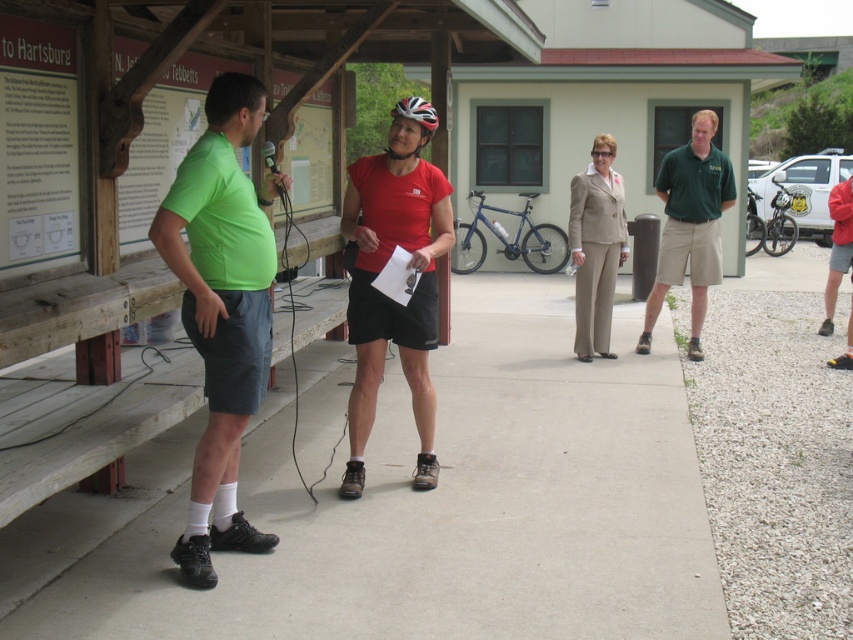
You are attending an outdoor event and want to read the wooden signboard at left and the beige fabric suit at center. Which object is easier to read from your current position?

The wooden signboard at left is closer to the viewer than the beige fabric suit at center, so it is easier to read from your current position.

You are standing at the wooden shelter where the gathering is happening. You notice two points marked in the scene. Which of the two points, point (x=41, y=35) or point (x=602, y=260), is closer to you?

Point (x=41, y=35) is closer to the camera than point (x=602, y=260), so the point closer to you is point (x=41, y=35).